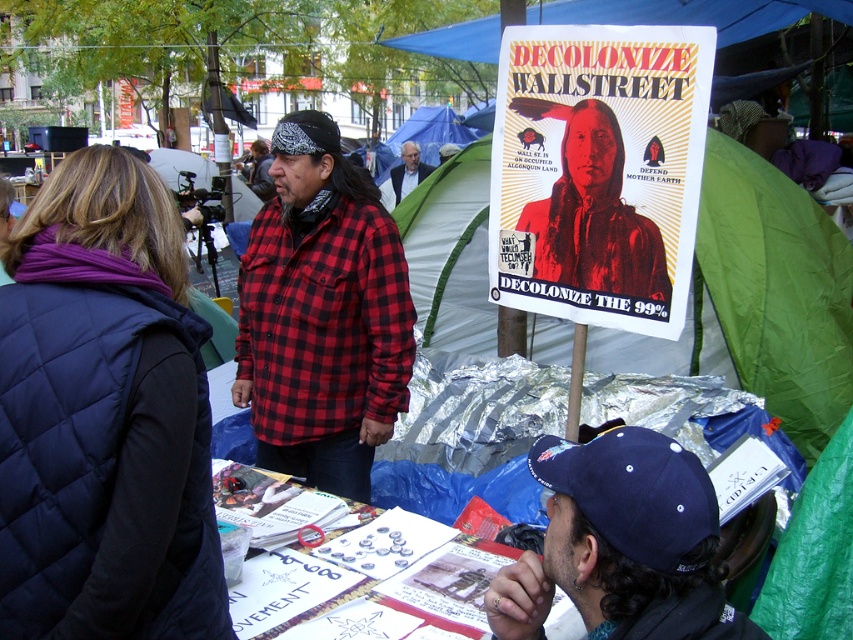
You are a photographer standing in the middle of the protest area. You want to capture a photo of both the red plaid shirt at center and the blue fabric canopy at upper center in the same frame. Which object should you position closer to the left side of your camera viewfinder to include both in the shot?

The red plaid shirt at center is to the left of the blue fabric canopy at upper center, so you should position the red plaid shirt at center closer to the left side of your camera viewfinder to include both in the shot.

You are a photographer trying to capture the protest scene. You notice the white paper poster at center and the blue fabric canopy at upper center. Which object is taller in the image?

The white paper poster at center is much taller than the blue fabric canopy at upper center.

You are an activist organizing a community event and need to decide which item to prioritize for transport. Given the white paper poster at center and the red plaid shirt at center, which one should you take first if you want to carry the larger item first?

The white paper poster at center is bigger than the red plaid shirt at center, so you should take the white paper poster at center first.